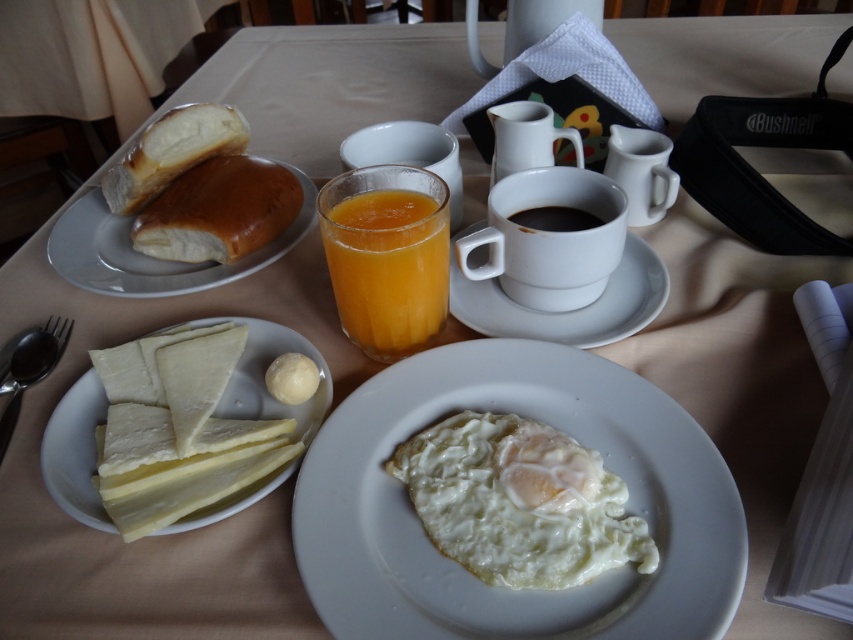
You are standing at a distance of 12.76 inches from the point labeled as point (x=445, y=586). If you want to move closer to this point, which direction should you move in relation to the breakfast items on the table?

Since the point (x=445, y=586) is 12.76 inches away from you, you should move towards the direction of the point to get closer. However, without knowing the exact location of the point in relation to the breakfast items, it is difficult to specify a direction relative to them.

You are a person with a 50 cm long arm. You want to reach the golden brown crusty bread at upper left from your current position. Can you comfortably reach it?

The golden brown crusty bread at upper left is 51.20 centimeters away from viewer. Since your arm is only 50 cm long, you cannot comfortably reach it without stretching or moving closer.